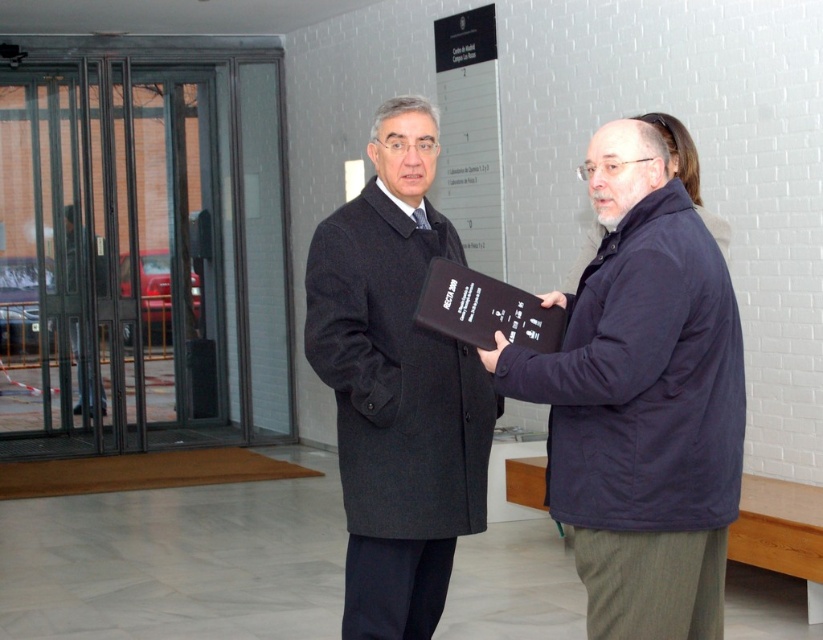
Question: Among these points, which one is nearest to the camera?

Choices:
 (A) [384, 317]
 (B) [742, 381]

Answer: (B)

Question: Is black matte book at center to the left of dark gray wool coat at center from the viewer's perspective?

Choices:
 (A) yes
 (B) no

Answer: (B)

Question: In this image, where is black matte book at center located relative to dark gray wool coat at center?

Choices:
 (A) above
 (B) below

Answer: (B)

Question: Does black matte book at center appear under dark gray wool coat at center?

Choices:
 (A) yes
 (B) no

Answer: (A)